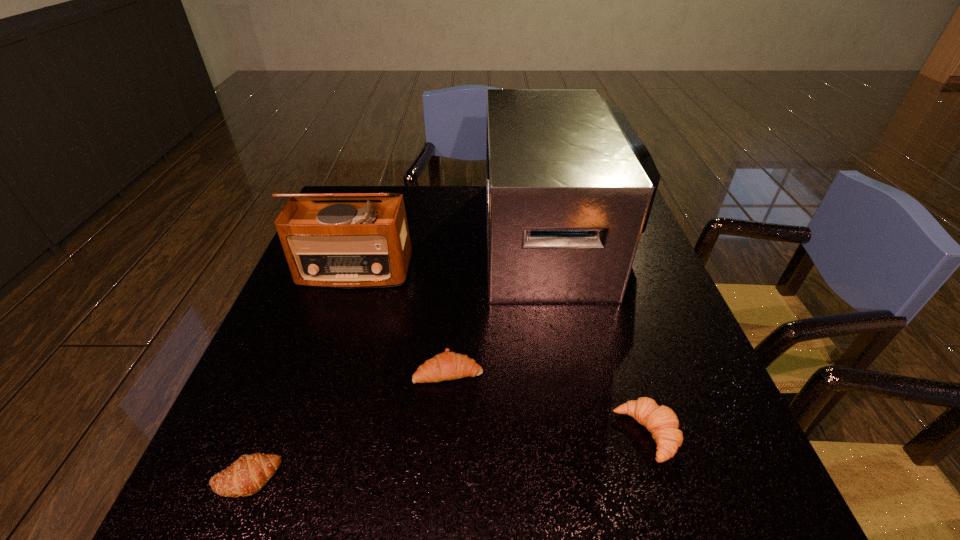
Locate an element on the screen. This screenshot has height=540, width=960. blank area in the image that satisfies the following two spatial constraints: 1. on the front panel of the farthest crescent roll; 2. on the right side of the second tallest object is located at coordinates (322, 370).

You are a GUI agent. You are given a task and a screenshot of the screen. Output one action in this format:
    pyautogui.click(x=<x>, y=<y>)
    Task: Click on the free space that satisfies the following two spatial constraints: 1. on the front-facing side of the microwave oven; 2. on the front panel of the second tallest object
    This screenshot has width=960, height=540.
    Given the screenshot: What is the action you would take?
    pyautogui.click(x=566, y=271)

Image resolution: width=960 pixels, height=540 pixels. Find the location of `blank area in the image that satisfies the following two spatial constraints: 1. on the front-facing side of the rightmost crescent roll; 2. on the right side of the microwave oven`. blank area in the image that satisfies the following two spatial constraints: 1. on the front-facing side of the rightmost crescent roll; 2. on the right side of the microwave oven is located at coordinates (604, 434).

This screenshot has height=540, width=960. I want to click on vacant space that satisfies the following two spatial constraints: 1. on the front-facing side of the rightmost crescent roll; 2. on the right side of the microwave oven, so click(x=604, y=434).